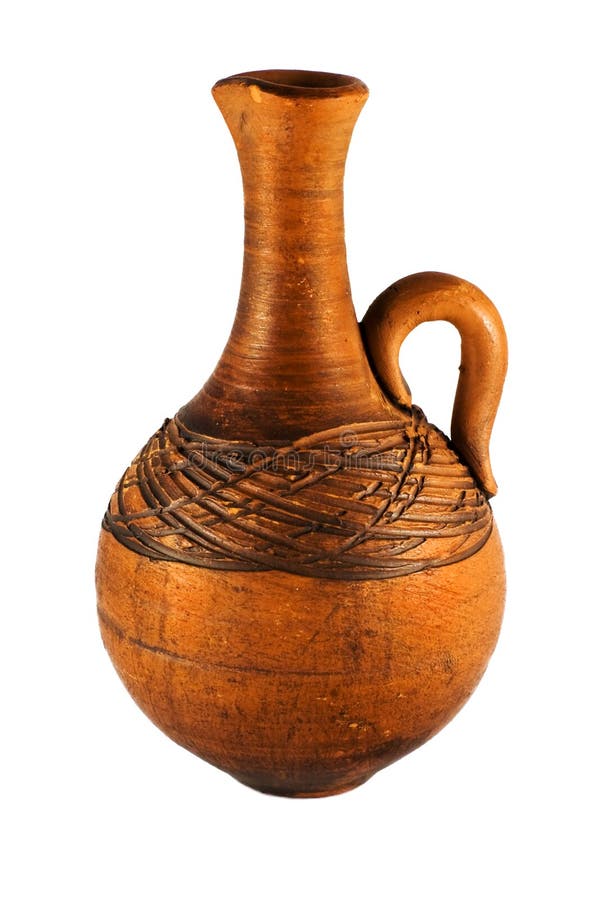
Where is `base of carafe`? base of carafe is located at coordinates (298, 787).